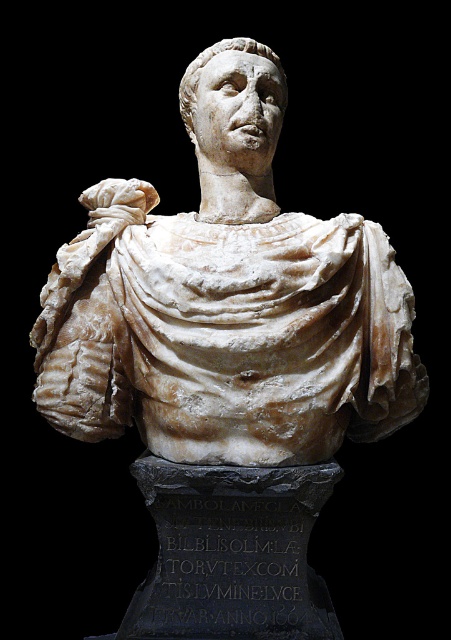
Is white marble bust at center further to camera compared to white marble head at center?

No, it is in front of white marble head at center.

Is white marble bust at center positioned in front of white marble head at center?

Yes, white marble bust at center is closer to the viewer.

This screenshot has width=451, height=640. In order to click on white marble bust at center in this screenshot , I will do `click(226, 301)`.

I want to click on white marble bust at center, so click(226, 301).